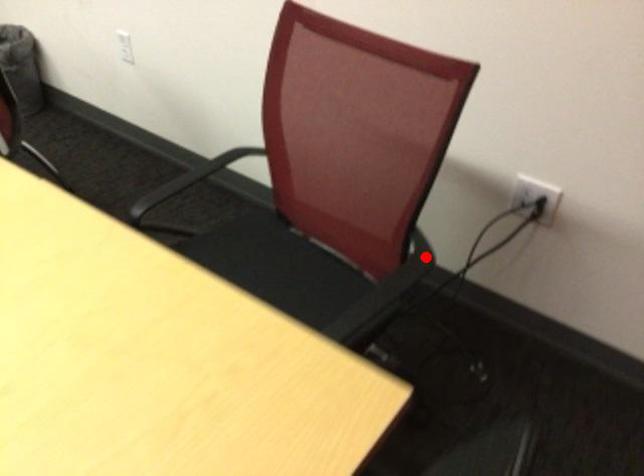
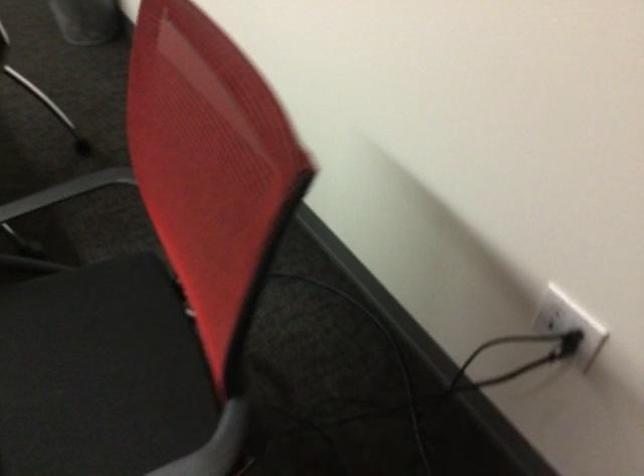
Question: I am providing you with two images of the same scene from different viewpoints. Given a red point in image1, look at the same physical point in image2. Is it:

Choices:
 (A) Closer to the viewpoint
 (B) Farther from the viewpoint

Answer: (A)